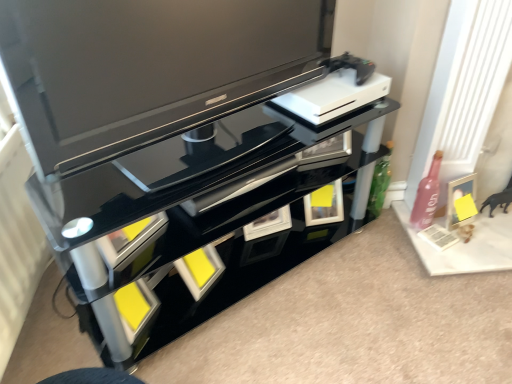
The height and width of the screenshot is (384, 512). Find the location of `vacant area that lies to the right of matte silver picture frame at right`. vacant area that lies to the right of matte silver picture frame at right is located at coordinates (492, 223).